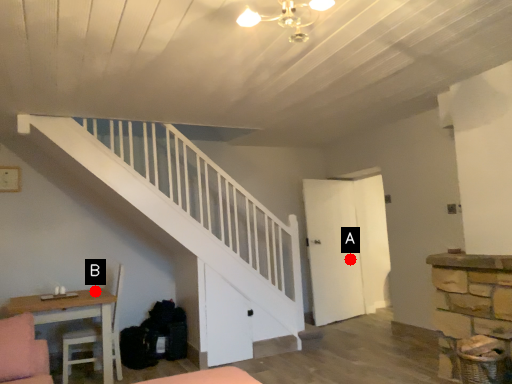
Question: Two points are circled on the image, labeled by A and B beside each circle. Among these points, which one is nearest to the camera?

Choices:
 (A) A is closer
 (B) B is closer

Answer: (B)